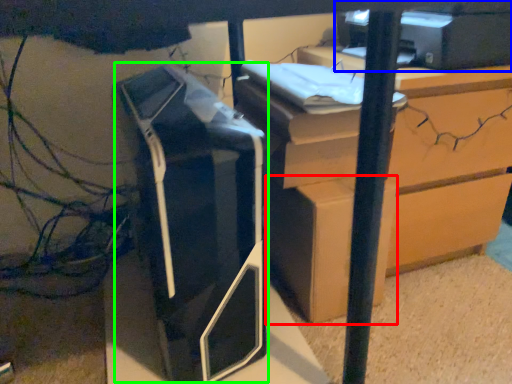
Question: Estimate the real-world distances between objects in this image. Which object is farther from cardboard box (highlighted by a red box), printer (highlighted by a blue box) or printer (highlighted by a green box)?

Choices:
 (A) printer
 (B) printer

Answer: (A)